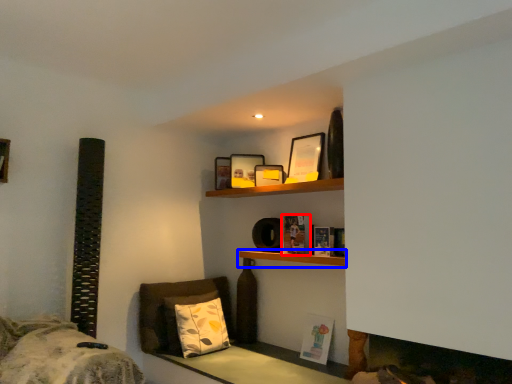
Question: Which point is closer to the camera, book (highlighted by a red box) or shelf (highlighted by a blue box)?

Choices:
 (A) book
 (B) shelf

Answer: (B)